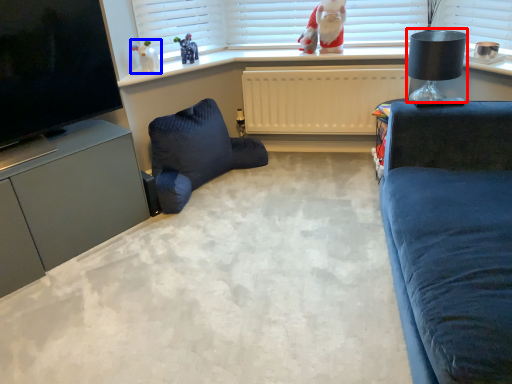
Question: Which of the following is the closest to the observer, lamp (highlighted by a red box) or toy (highlighted by a blue box)?

Choices:
 (A) lamp
 (B) toy

Answer: (A)